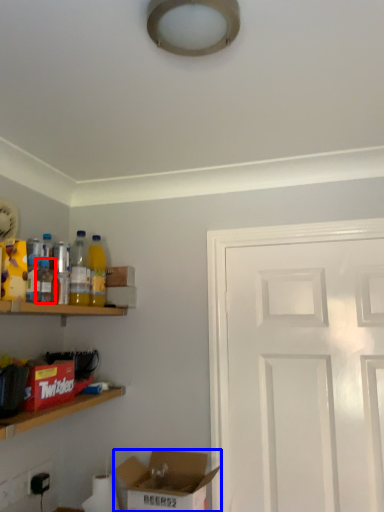
Question: Which object is closer to the camera taking this photo, bottle (highlighted by a red box) or box (highlighted by a blue box)?

Choices:
 (A) bottle
 (B) box

Answer: (B)